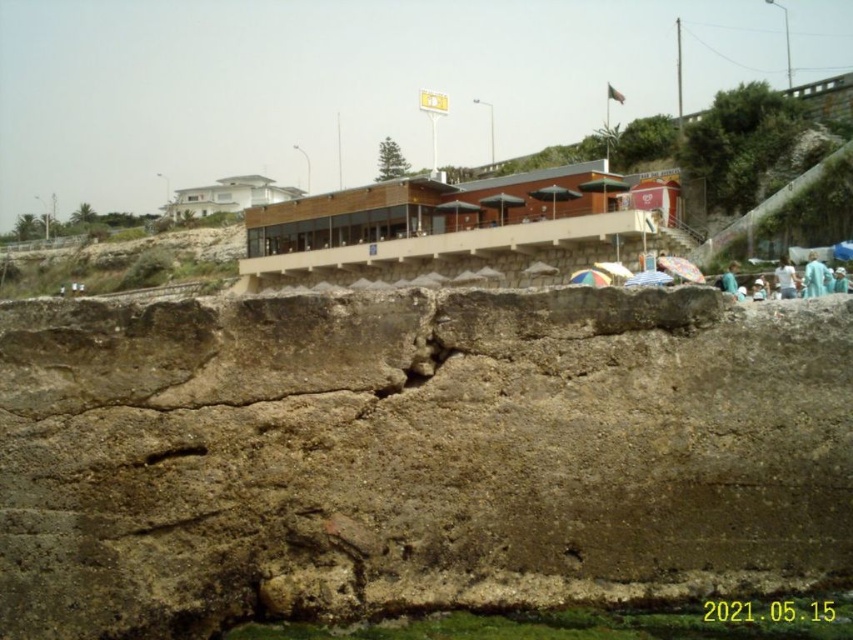
Question: Which of the following is the farthest from the observer?

Choices:
 (A) light blue fabric at lower right
 (B) brown rough rock at lower center

Answer: (A)

Question: Where is brown rough rock at lower center located in relation to light blue fabric at lower right in the image?

Choices:
 (A) right
 (B) left

Answer: (B)

Question: Among these objects, which one is farthest from the camera?

Choices:
 (A) white fabric at lower right
 (B) blue fabric at lower right
 (C) light blue fabric at lower right

Answer: (A)

Question: Is blue fabric at lower right to the left of white fabric at lower right from the viewer's perspective?

Choices:
 (A) yes
 (B) no

Answer: (B)

Question: Can you confirm if brown rough rock at lower center is wider than blue fabric at lower right?

Choices:
 (A) yes
 (B) no

Answer: (A)

Question: Estimate the real-world distances between objects in this image. Which object is farther from the light blue fabric at lower right?

Choices:
 (A) white fabric at lower right
 (B) blue fabric at lower right

Answer: (B)